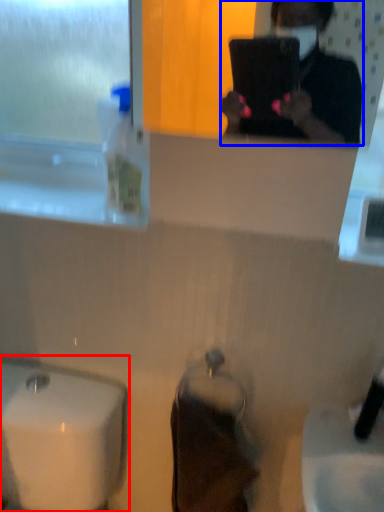
Question: Which point is closer to the camera, sink (highlighted by a red box) or person (highlighted by a blue box)?

Choices:
 (A) sink
 (B) person

Answer: (B)